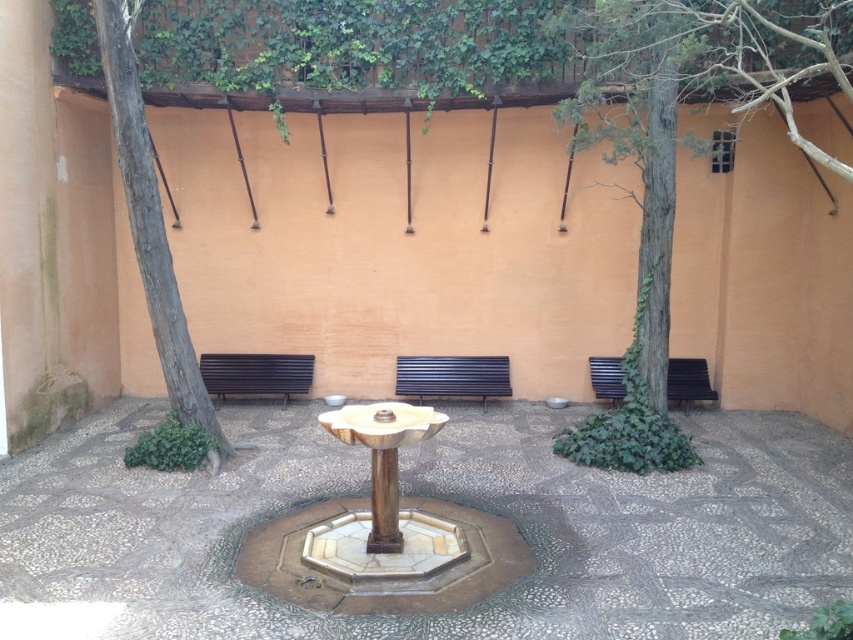
You are sitting on the wooden park bench at right and looking towards the green leafy tree at left. Which object is taller?

The green leafy tree at left is taller than the wooden park bench at right.

You are sitting on the wooden park bench at right and want to look at the green leafy tree at left. Which direction should you turn your head to see it?

You should turn your head to the left to see the green leafy tree at left because it is closer to you than the wooden park bench at right, meaning it is positioned to the left side of the courtyard.

You are standing in the courtyard and want to take a photo of the green leafy tree at left. Where should you position yourself to capture it in the frame?

To capture the green leafy tree at left in your photo, position yourself at point (151,227).